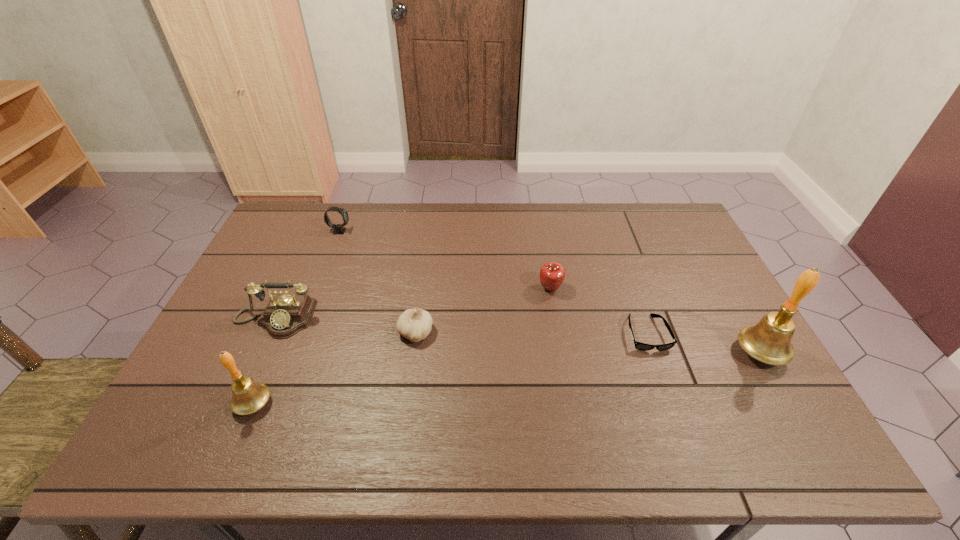
Image resolution: width=960 pixels, height=540 pixels. What are the coordinates of `unoccupied area between the fifth shortest object and the fifth object from left to right` in the screenshot? It's located at (413, 304).

Image resolution: width=960 pixels, height=540 pixels. What are the coordinates of `free space between the sixth nearest object and the shortest object` in the screenshot? It's located at (598, 311).

What are the coordinates of `free space between the sixth object from left to right and the rightmost object` in the screenshot? It's located at (704, 343).

Image resolution: width=960 pixels, height=540 pixels. Find the location of `free spot between the tallest object and the third object from right to left`. free spot between the tallest object and the third object from right to left is located at coordinates pos(655,321).

You are a GUI agent. You are given a task and a screenshot of the screen. Output one action in this format:
    pyautogui.click(x=<x>, y=<y>)
    Task: Click on the empty location between the watch and the telephone
    This screenshot has height=540, width=960.
    Given the screenshot: What is the action you would take?
    pyautogui.click(x=307, y=275)

This screenshot has width=960, height=540. In order to click on empty space between the sixth object from left to right and the shorter bell in this screenshot , I will do `click(450, 368)`.

The height and width of the screenshot is (540, 960). Find the location of `vacant region between the third object from right to left and the watch`. vacant region between the third object from right to left and the watch is located at coordinates (445, 260).

Where is `object that is the second closest to the nearest object`? The image size is (960, 540). object that is the second closest to the nearest object is located at coordinates pos(415,324).

Identify which object is the fifth nearest to the fourth object from left to right. Please provide its 2D coordinates. Your answer should be formatted as a tuple, i.e. [(x, y)], where the tuple contains the x and y coordinates of a point satisfying the conditions above.

[(638, 345)]

Image resolution: width=960 pixels, height=540 pixels. Identify the location of free space that satisfies the following two spatial constraints: 1. on the face of the farthest object; 2. on the back side of the tallest object. (293, 353).